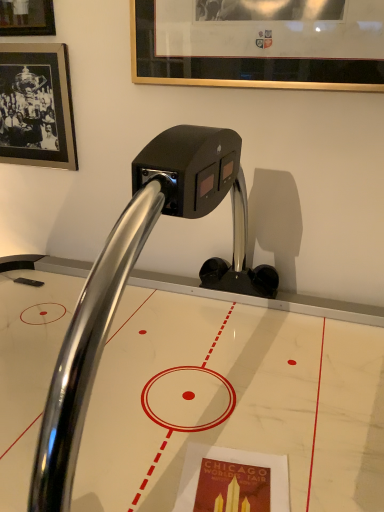
Question: From a real-world perspective, is black matte picture frame at upper left, which is the 2th picture frame in front-to-back order, above or below gold-framed picture at upper center, which is counted as the 1th picture frame, starting from the front?

Choices:
 (A) above
 (B) below

Answer: (B)

Question: Considering the positions of point (8, 126) and point (357, 27), is point (8, 126) closer or farther from the camera than point (357, 27)?

Choices:
 (A) farther
 (B) closer

Answer: (A)

Question: Estimate the real-world distances between objects in this image. Which object is closer to the black matte picture frame at upper left, the first picture frame viewed from the back?

Choices:
 (A) polished chrome faucet at center
 (B) gold-framed picture at upper center, which is counted as the 1th picture frame, starting from the front

Answer: (B)

Question: Estimate the real-world distances between objects in this image. Which object is closer to the polished chrome faucet at center?

Choices:
 (A) black matte picture frame at upper left, the first picture frame viewed from the back
 (B) gold-framed picture at upper center, marked as the 2th picture frame in a left-to-right arrangement

Answer: (B)